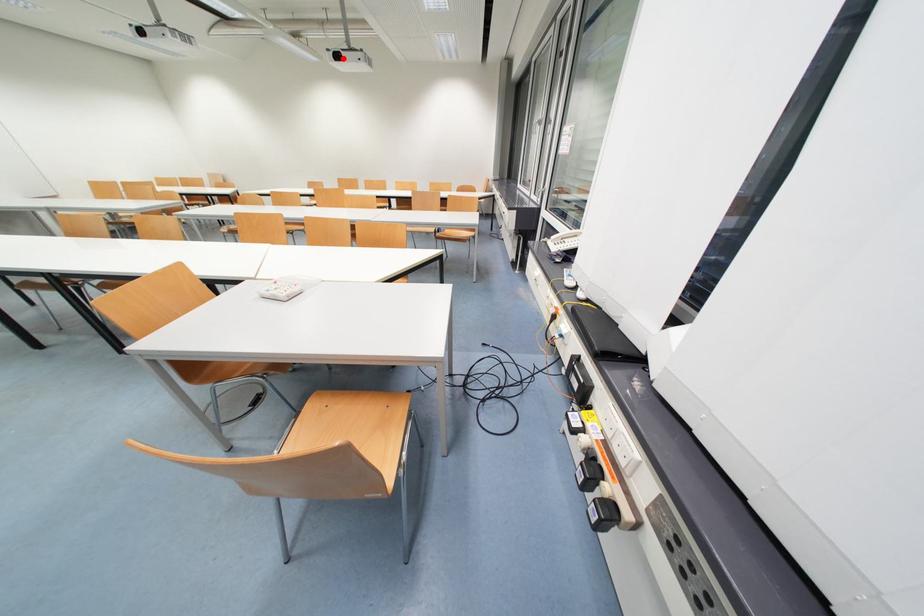
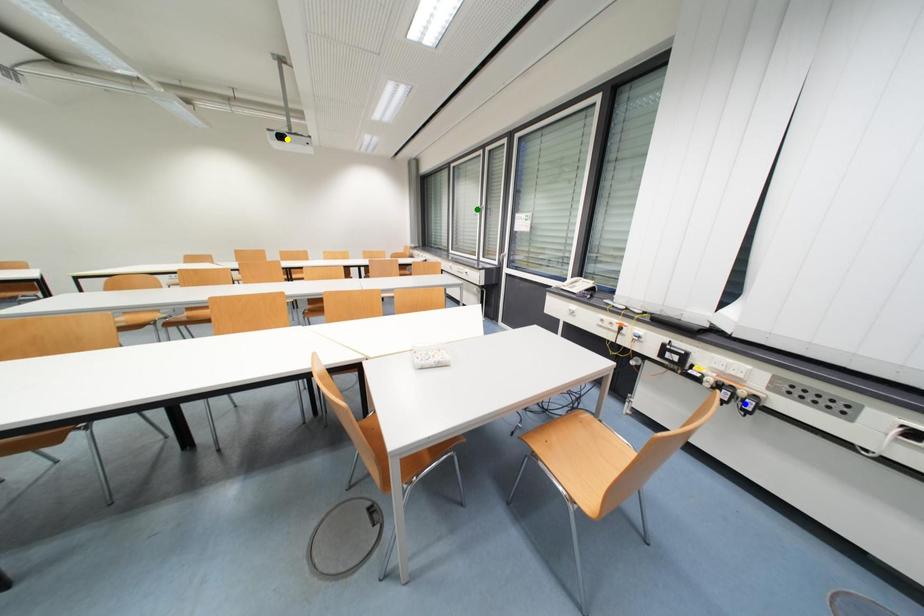
Question: I am providing you with two images of the same scene from different viewpoints. A red point is marked on the first image. You are given multiple points on the second image. Which mark in image 2 goes with the point in image 1?

Choices:
 (A) blue point
 (B) yellow point
 (C) green point

Answer: (B)